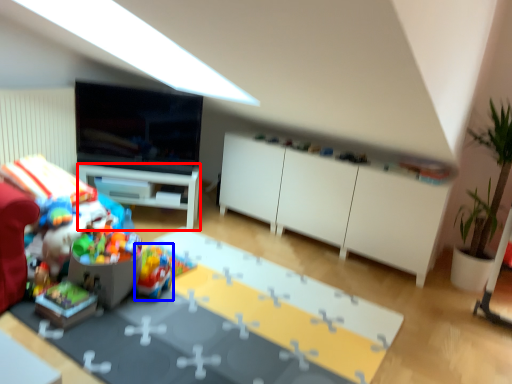
Question: Which of the following is the closest to the observer, desk (highlighted by a red box) or toy (highlighted by a blue box)?

Choices:
 (A) desk
 (B) toy

Answer: (B)